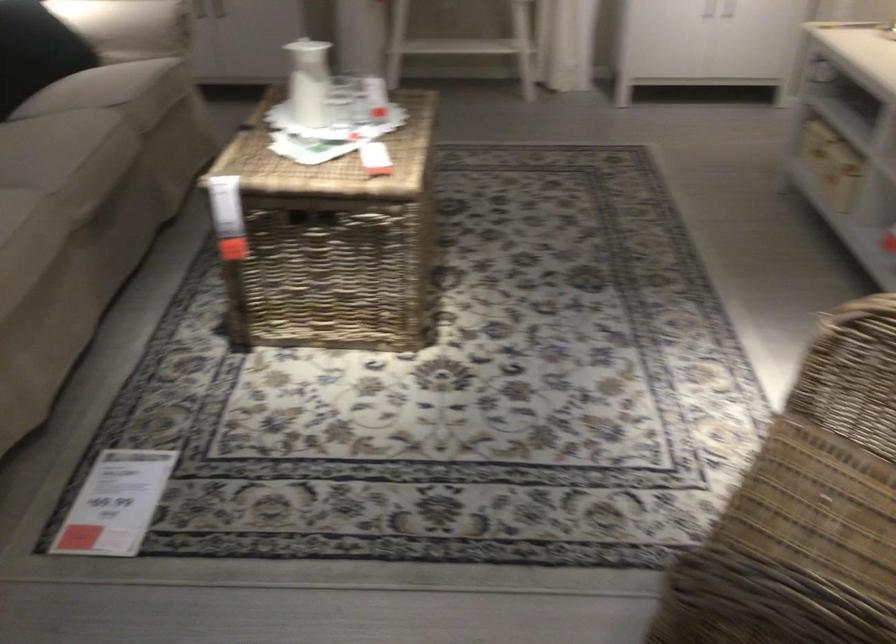
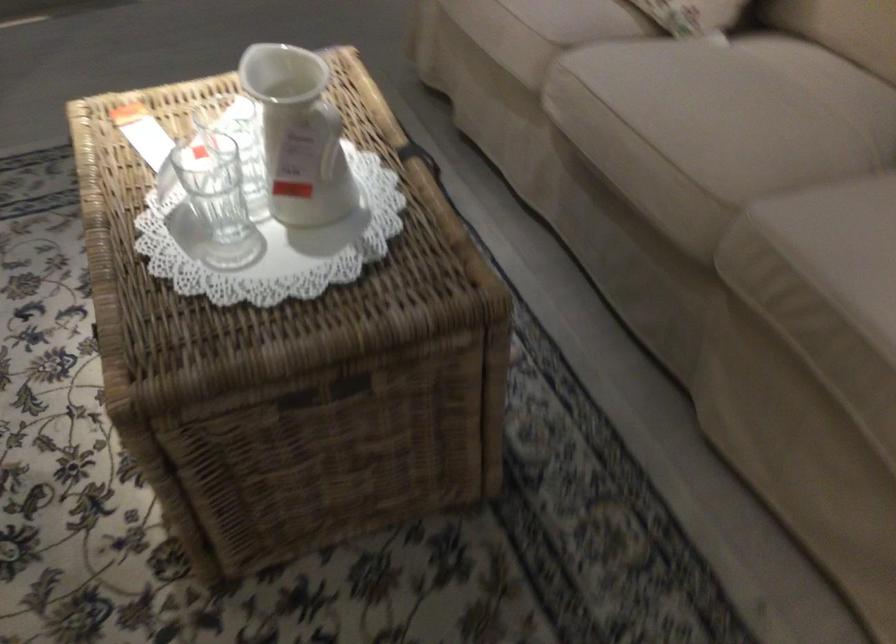
Where in the second image is the point corresponding to (x=108, y=126) from the first image?

(704, 167)